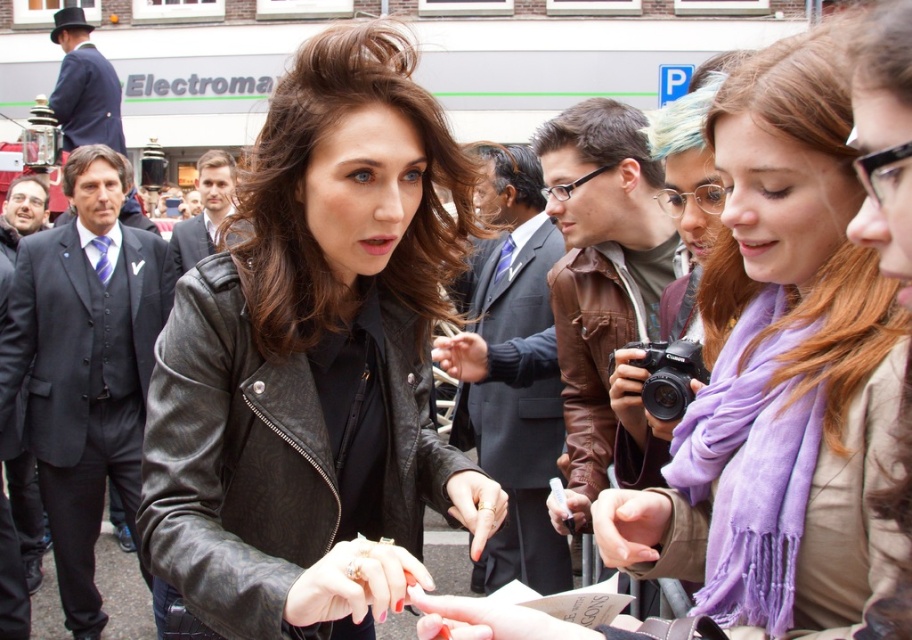
In the scene shown: Does black leather jacket at center appear under purple scarf at center?

Yes.

Does point (265, 424) lie behind point (867, 358)?

Yes, it is behind point (867, 358).

Locate an element on the screen. black leather jacket at center is located at coordinates (313, 362).